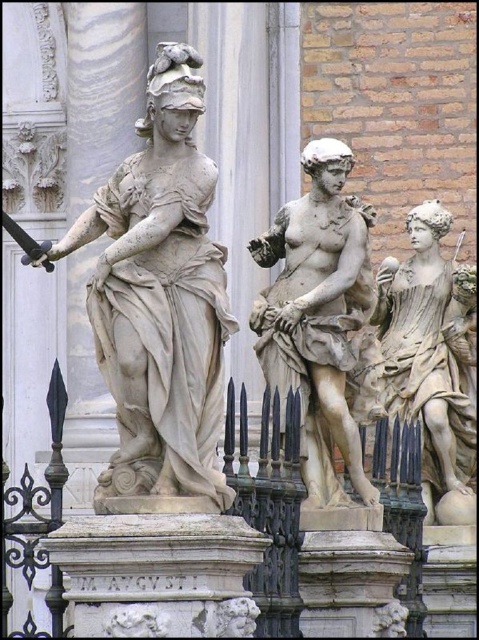
Is point (203, 90) positioned after point (54, 584)?

Yes, point (203, 90) is farther from viewer.

Which is more to the right, white marble statue at center or black wrought iron fence at center?

black wrought iron fence at center

Which is in front, point (135, 460) or point (296, 472)?

Point (135, 460) is in front.

Where is `white marble statue at center`? The height and width of the screenshot is (640, 479). white marble statue at center is located at coordinates (160, 296).

Can you confirm if matte stone statue at center is positioned above matte beige statue at right?

Yes.

Is point (338, 445) in front of point (467, 433)?

That is True.

Where is `matte stone statue at center`? matte stone statue at center is located at coordinates (319, 316).

Locate an element on the screen. The height and width of the screenshot is (640, 479). matte stone statue at center is located at coordinates (319, 316).

Who is positioned more to the right, white marble statue at center or matte stone statue at center?

Positioned to the right is matte stone statue at center.

Does white marble statue at center have a lesser height compared to matte stone statue at center?

No.

Which is behind, point (23, 257) or point (337, 180)?

The point (337, 180) is more distant.

What are the coordinates of `white marble statue at center` in the screenshot? It's located at (160, 296).